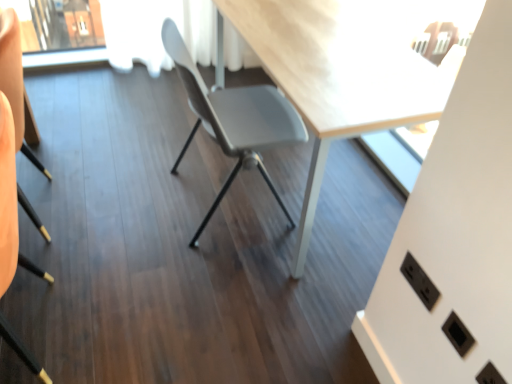
Question: Does point (19, 97) appear closer or farther from the camera than point (419, 271)?

Choices:
 (A) closer
 (B) farther

Answer: (B)

Question: From the image's perspective, is black matte chair at lower left, the 1th chair viewed from the left, located above or below black plastic electric outlet at lower right?

Choices:
 (A) above
 (B) below

Answer: (A)

Question: Which object is positioned closest to the black plastic electric outlet at lower right?

Choices:
 (A) black matte chair at lower left, which appears as the second chair when viewed from the right
 (B) matte gray chair at center, which is the first chair from right to left

Answer: (B)

Question: Estimate the real-world distances between objects in this image. Which object is farther from the matte gray chair at center, which is the first chair from right to left?

Choices:
 (A) black plastic electric outlet at lower right
 (B) black matte chair at lower left, the 1th chair viewed from the left

Answer: (A)